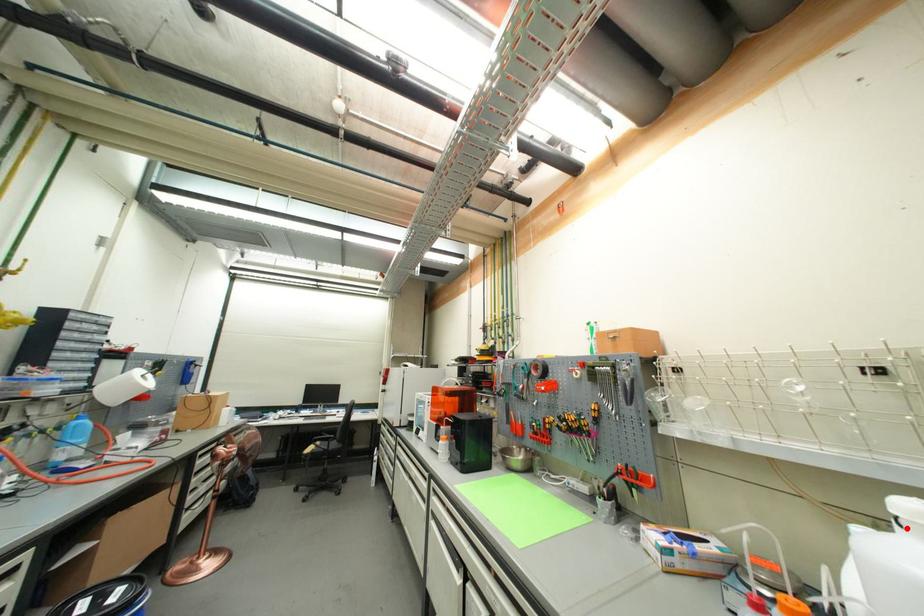
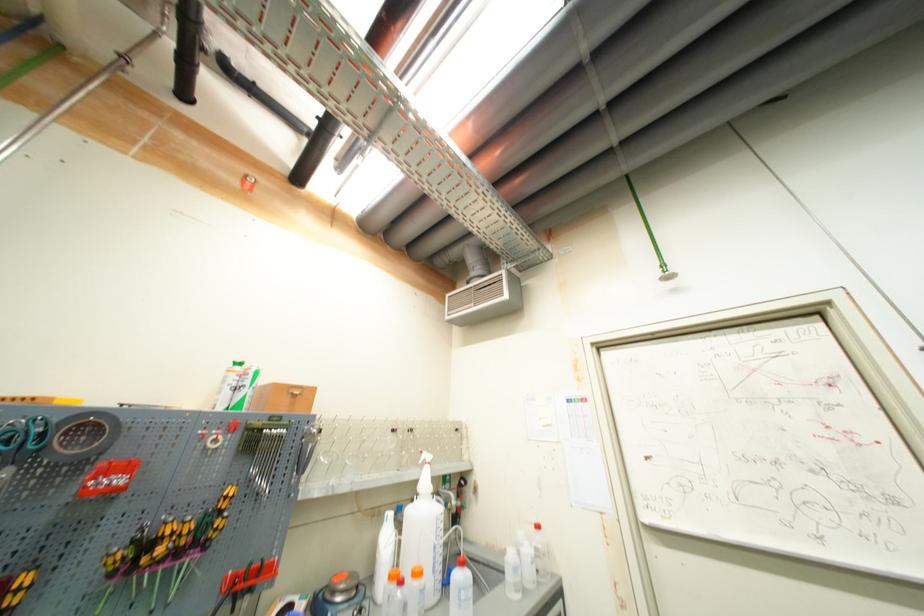
Question: I am providing you with two images of the same scene from different viewpoints. In image1, a red point is highlighted. Considering the same 3D point in image2, which of the following is correct?

Choices:
 (A) It is closer
 (B) It is farther

Answer: (B)